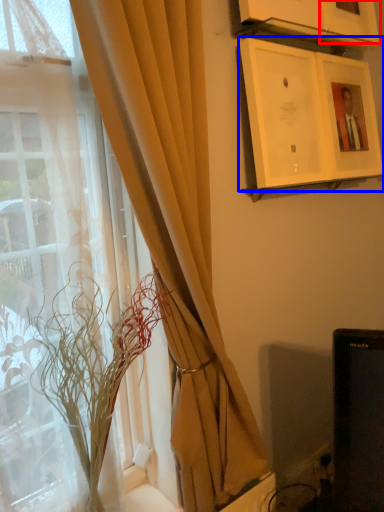
Question: Among these objects, which one is nearest to the camera, picture frame (highlighted by a red box) or picture frame (highlighted by a blue box)?

Choices:
 (A) picture frame
 (B) picture frame

Answer: (B)